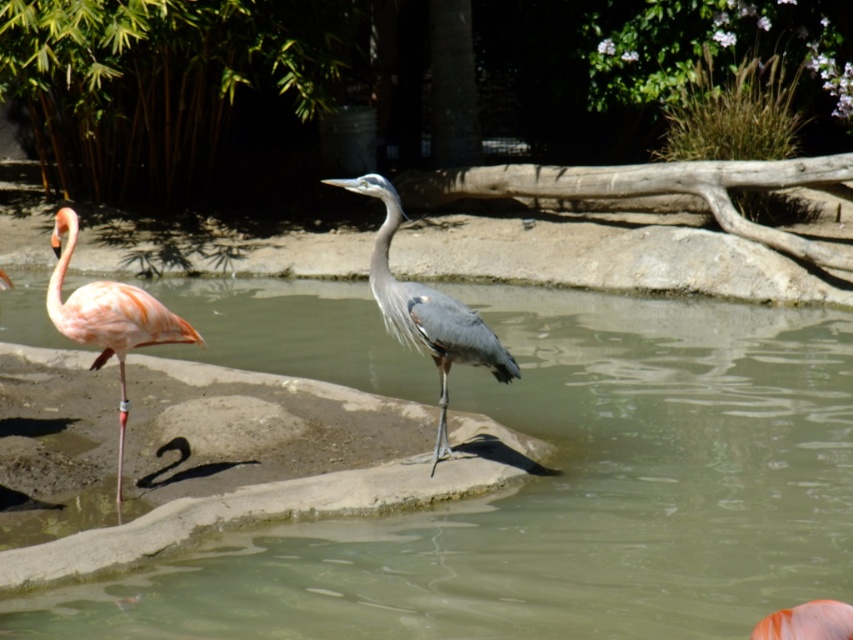
You are a birdwatcher observing the scene. You notice the gray matte heron at center and the pink feathered flamingo at left. Which bird is positioned higher in the image?

The gray matte heron at center is positioned higher in the image than the pink feathered flamingo at left.

You are a birdwatcher observing the scene. You notice the gray matte heron at center and the pink feathered flamingo at left. Which bird is positioned to the right of the other?

The gray matte heron at center is positioned to the right of the pink feathered flamingo at left.